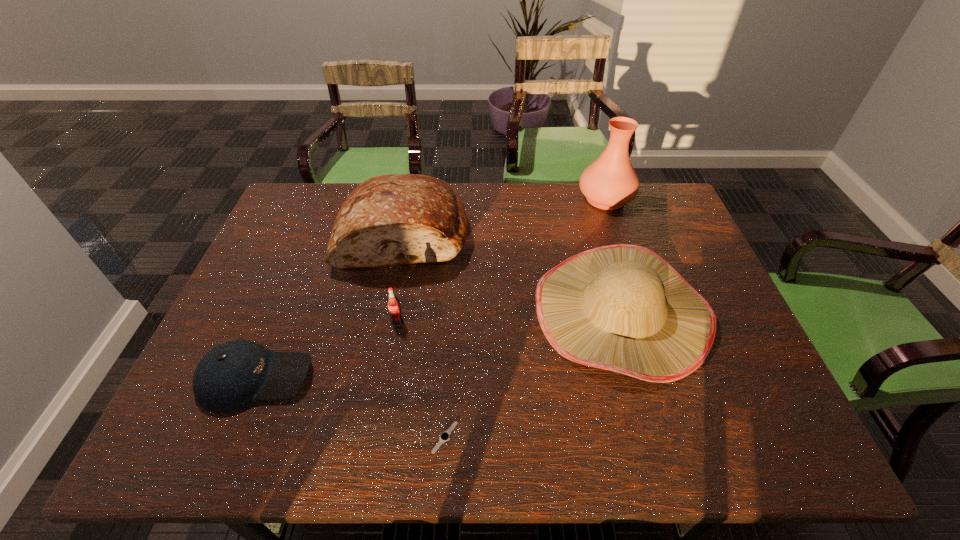
Identify the location of free location located 0.150m on the label of the third shortest object. The height and width of the screenshot is (540, 960). (388, 378).

You are a GUI agent. You are given a task and a screenshot of the screen. Output one action in this format:
    pyautogui.click(x=<x>, y=<y>)
    Task: Click on the vacant space located on the front-facing side of the baseball cap
    
    Given the screenshot: What is the action you would take?
    pyautogui.click(x=373, y=378)

You are a GUI agent. You are given a task and a screenshot of the screen. Output one action in this format:
    pyautogui.click(x=<x>, y=<y>)
    Task: Click on the vacant area located 0.130m on the right of the nearest object
    
    Given the screenshot: What is the action you would take?
    pyautogui.click(x=520, y=437)

The width and height of the screenshot is (960, 540). Identify the location of vase at the far edge. (608, 183).

This screenshot has height=540, width=960. What are the coordinates of `bread located in the far edge section of the desktop` in the screenshot? It's located at (396, 219).

The image size is (960, 540). Find the location of `object that is positioned at the near edge`. object that is positioned at the near edge is located at coordinates (445, 436).

What are the coordinates of `object that is at the left edge` in the screenshot? It's located at (232, 375).

What are the coordinates of `vase positioned at the right edge` in the screenshot? It's located at (608, 183).

Locate an element on the screen. The height and width of the screenshot is (540, 960). sunhat that is at the right edge is located at coordinates (622, 307).

Locate an element on the screen. object that is at the far right corner is located at coordinates (608, 183).